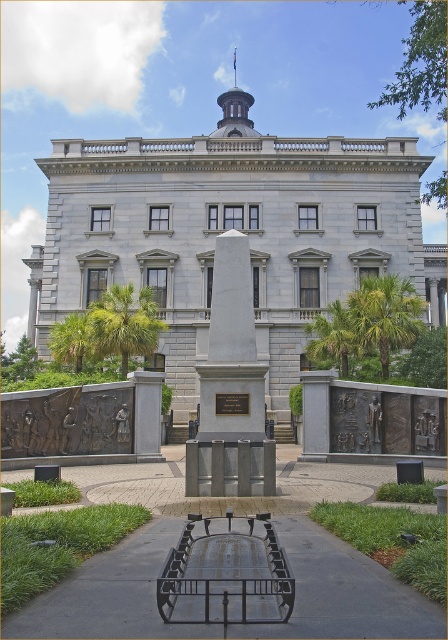
Is metallic park bench at center positioned in front of white marble obelisk at center?

That is True.

Is metallic park bench at center smaller than white marble obelisk at center?

Yes.

Is point (266, 616) farther from camera compared to point (222, 291)?

No.

Identify the location of metallic park bench at center. This screenshot has height=640, width=448. (225, 576).